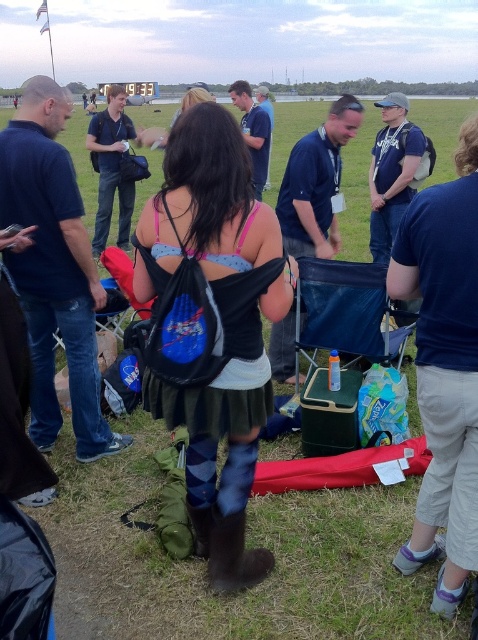
Question: Among these objects, which one is nearest to the camera?

Choices:
 (A) blue shirt at center
 (B) denim skirt at center
 (C) matte black jacket at center
 (D) blue denim shirt at center

Answer: (B)

Question: Estimate the real-world distances between objects in this image. Which object is farther from the blue denim shirt at center?

Choices:
 (A) dark blue t-shirt at center
 (B) dark blue shirt at left
 (C) matte black jacket at center

Answer: (A)

Question: Can you confirm if denim skirt at center is bigger than dark blue shirt at left?

Choices:
 (A) yes
 (B) no

Answer: (B)

Question: Does dark blue shirt at left appear over matte black jacket at center?

Choices:
 (A) no
 (B) yes

Answer: (A)

Question: Which point is closer to the camera taking this photo?

Choices:
 (A) (219, 241)
 (B) (66, 200)
 (C) (113, 99)
 (D) (241, 88)

Answer: (A)

Question: Does dark blue t-shirt at center have a lesser width compared to dark blue shirt at left?

Choices:
 (A) no
 (B) yes

Answer: (B)